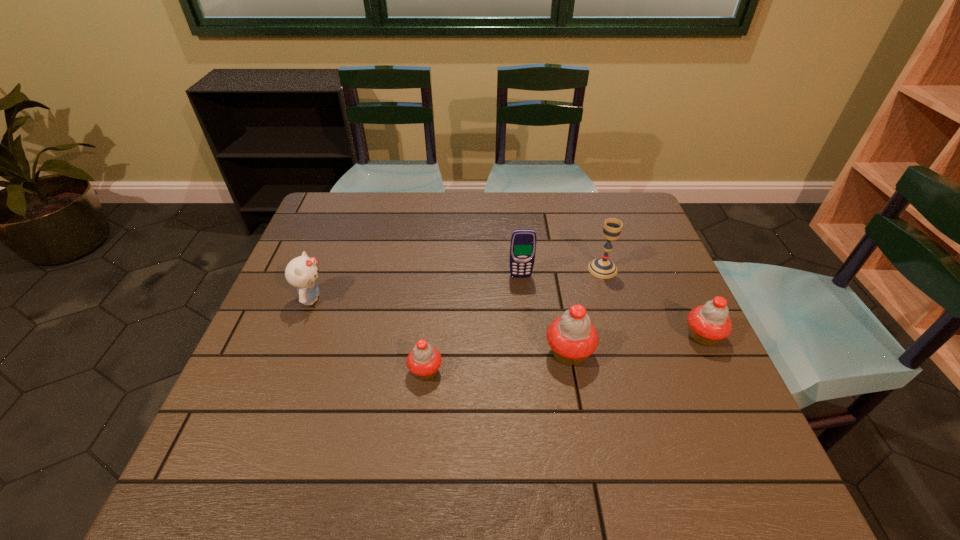
I want to click on vacant space that satisfies the following two spatial constraints: 1. on the front-facing side of the third farthest object; 2. on the left side of the leftmost cupcake, so click(283, 371).

Where is `blank space that satisfies the following two spatial constraints: 1. on the back side of the chalice; 2. on the left side of the fourth object from left to right`? blank space that satisfies the following two spatial constraints: 1. on the back side of the chalice; 2. on the left side of the fourth object from left to right is located at coordinates (x=554, y=268).

Identify the location of vacant space that satisfies the following two spatial constraints: 1. on the front-facing side of the third object from left to right; 2. on the front-facing side of the leftmost object. (523, 299).

In order to click on free space that satisfies the following two spatial constraints: 1. on the front-facing side of the leftmost object; 2. on the right side of the shortest cupcake in this screenshot , I will do `click(283, 371)`.

Identify the location of free space that satisfies the following two spatial constraints: 1. on the front-facing side of the fourth object from right to left; 2. on the right side of the second shortest cupcake. (526, 336).

The width and height of the screenshot is (960, 540). Identify the location of free space that satisfies the following two spatial constraints: 1. on the front-facing side of the fourth object from right to left; 2. on the front-facing side of the leftmost object. (523, 299).

Locate an element on the screen. Image resolution: width=960 pixels, height=540 pixels. vacant area that satisfies the following two spatial constraints: 1. on the front-facing side of the cellular telephone; 2. on the left side of the tallest cupcake is located at coordinates (528, 353).